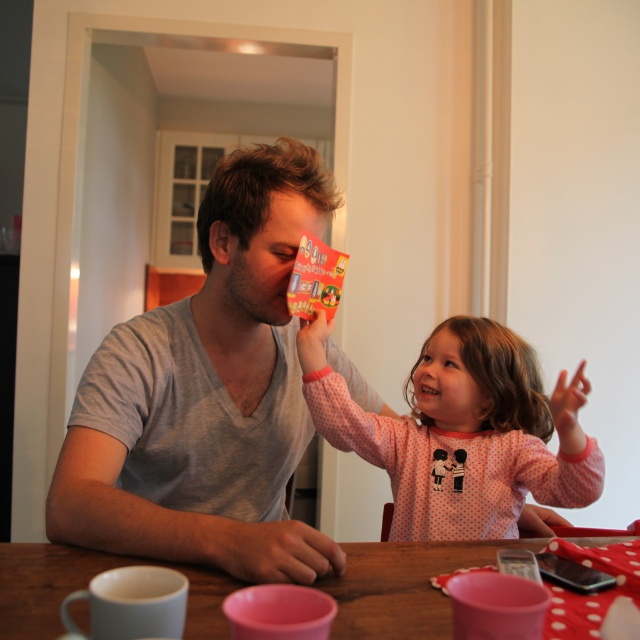
What is located at the coordinates point (x=205, y=396)?

The gray cotton shirt at center is located at point (x=205, y=396).

You are a tailor who needs to know if the gray cotton shirt at center can be placed on the wooden table at center without hanging off the edges. Can it fit?

The gray cotton shirt at center has a width less than the wooden table at center, so it can be placed on the wooden table at center without hanging off the edges.

You are trying to decide whether to place a large plate on the table. Based on the scene, which object, the gray cotton shirt at center or the wooden table at center, has a larger size?

The gray cotton shirt at center is bigger than the wooden table at center, so the gray cotton shirt at center is larger in size.